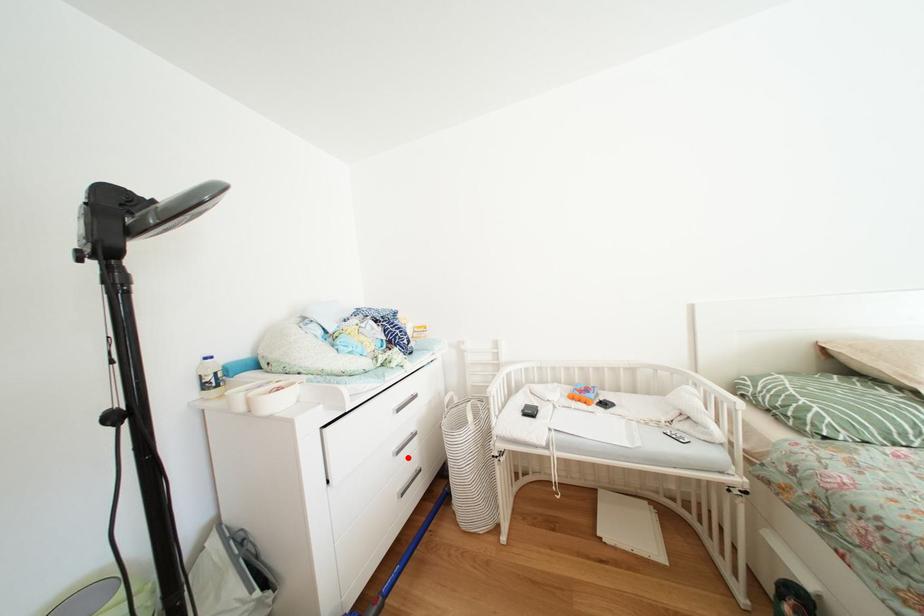
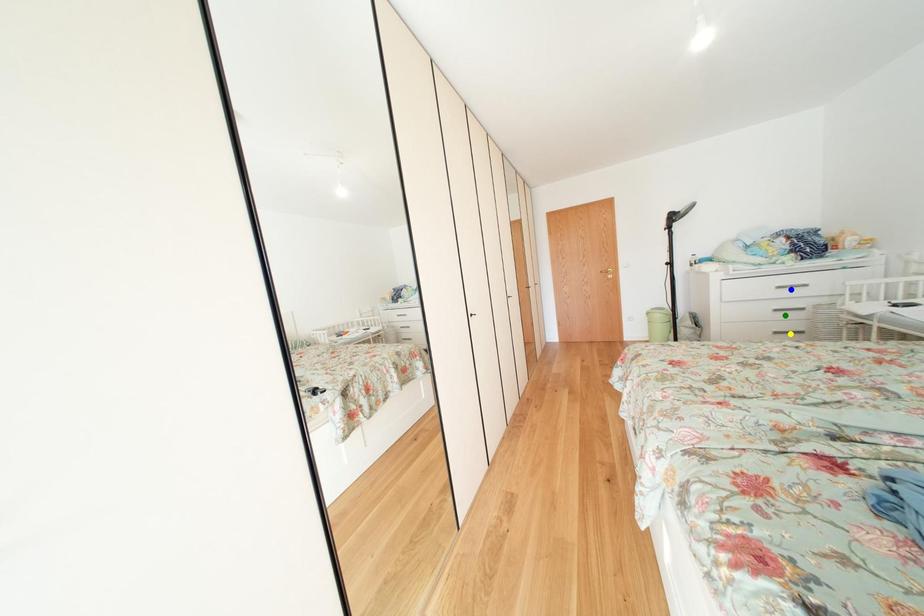
Question: I am providing you with two images of the same scene from different viewpoints. A red point is marked on the first image. You are given multiple points on the second image. Which point in image 2 is actually the same real-world point as the red point in image 1?

Choices:
 (A) yellow point
 (B) green point
 (C) blue point

Answer: (B)